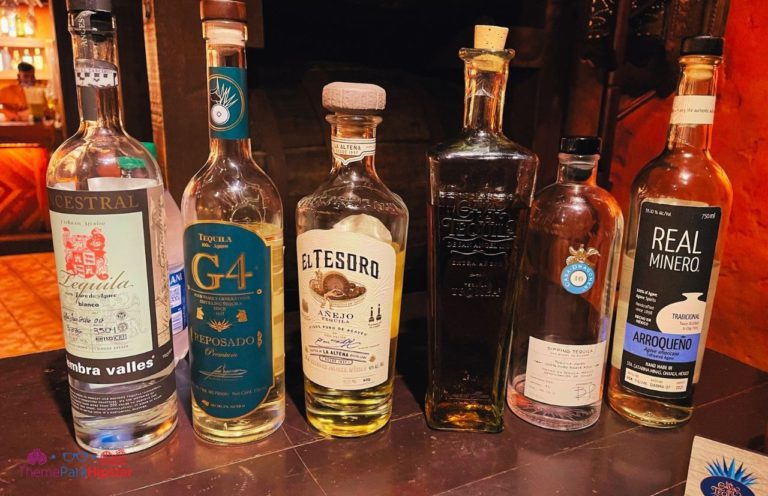
At what (x,y) coordinates should I click in order to perform the action: click on mirror. Please return your answer as a coordinate pair (x, y). The width and height of the screenshot is (768, 496). Looking at the image, I should click on (8, 92).